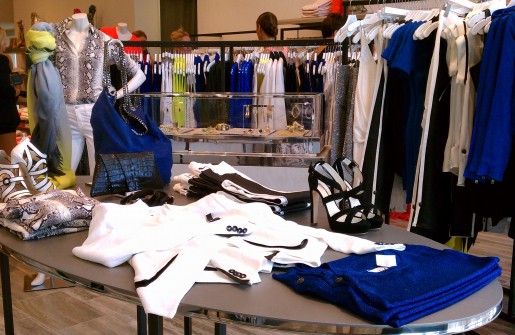
At what (x,y) coordinates should I click in order to perform the action: click on white wall. Please return your answer as a coordinate pair (x, y). Looking at the image, I should click on (238, 9), (151, 9).